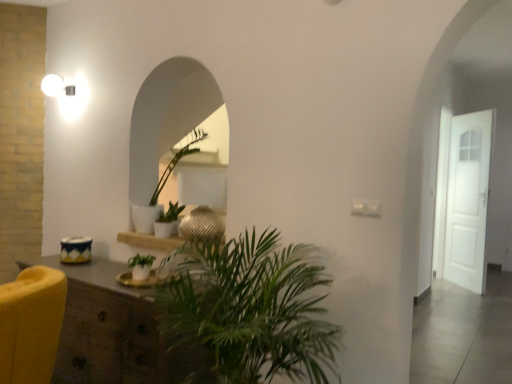
Question: Does green leafy plant at center, which ranks as the first houseplant in bottom-to-top order, have a lesser width compared to white matte door at right?

Choices:
 (A) no
 (B) yes

Answer: (A)

Question: From a real-world perspective, does green leafy plant at center, acting as the 1th houseplant starting from the front, sit lower than white matte door at right?

Choices:
 (A) yes
 (B) no

Answer: (A)

Question: Considering the relative sizes of green leafy plant at center, the 3th houseplant in the top-to-bottom sequence, and white matte door at right in the image provided, is green leafy plant at center, the 3th houseplant in the top-to-bottom sequence, shorter than white matte door at right?

Choices:
 (A) no
 (B) yes

Answer: (B)

Question: Is green leafy plant at center, acting as the 1th houseplant starting from the front, taller than white matte door at right?

Choices:
 (A) yes
 (B) no

Answer: (B)

Question: Is green leafy plant at center, the 3th houseplant when ordered from back to front, outside of white matte door at right?

Choices:
 (A) yes
 (B) no

Answer: (A)

Question: From the image's perspective, does green leafy plant at center, acting as the 1th houseplant starting from the front, appear lower than white matte door at right?

Choices:
 (A) no
 (B) yes

Answer: (B)

Question: From a real-world perspective, is wooden shelf at center over wooden cabinet at lower left?

Choices:
 (A) yes
 (B) no

Answer: (A)

Question: Is wooden shelf at center bigger than wooden cabinet at lower left?

Choices:
 (A) yes
 (B) no

Answer: (B)

Question: Does wooden shelf at center lie in front of wooden cabinet at lower left?

Choices:
 (A) no
 (B) yes

Answer: (A)

Question: Is wooden shelf at center wider than wooden cabinet at lower left?

Choices:
 (A) yes
 (B) no

Answer: (B)

Question: Is wooden shelf at center not inside wooden cabinet at lower left?

Choices:
 (A) yes
 (B) no

Answer: (A)

Question: Is wooden shelf at center at the left side of wooden cabinet at lower left?

Choices:
 (A) no
 (B) yes

Answer: (A)

Question: From a real-world perspective, is wooden cabinet at lower left located higher than wooden shelf at center?

Choices:
 (A) yes
 (B) no

Answer: (B)